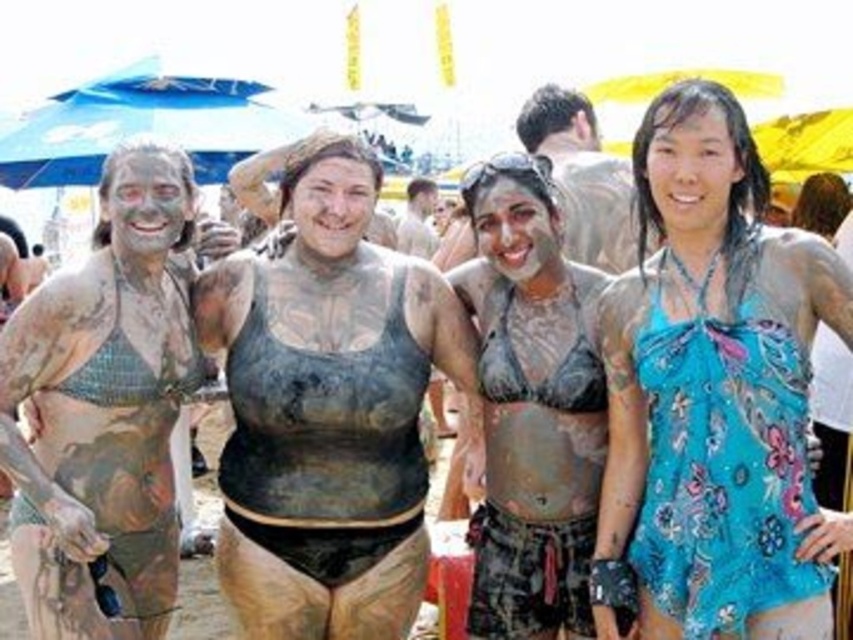
Which is in front, point (543, 220) or point (316, 212)?

Point (316, 212) is more forward.

You are a GUI agent. You are given a task and a screenshot of the screen. Output one action in this format:
    pyautogui.click(x=<x>, y=<y>)
    Task: Click on the matte clay face at center
    Image resolution: width=853 pixels, height=640 pixels.
    Given the screenshot: What is the action you would take?
    pyautogui.click(x=517, y=232)

Measure the distance between point (167, 161) and camera.

A distance of 28.61 meters exists between point (167, 161) and camera.

Is the position of matte mud mask at left less distant than that of matte mud face at center?

Yes, matte mud mask at left is closer to the viewer.

Find the location of a particular element. matte mud mask at left is located at coordinates (x=148, y=196).

Between blue floral dress at center and smooth skin face at center, which one is positioned lower?

Positioned lower is blue floral dress at center.

Who is more distant from viewer, (686, 102) or (717, 145)?

The point (686, 102) is behind.

At what (x,y) coordinates should I click in order to perform the action: click on blue floral dress at center. Please return your answer as a coordinate pair (x, y). This screenshot has width=853, height=640. Looking at the image, I should click on (711, 392).